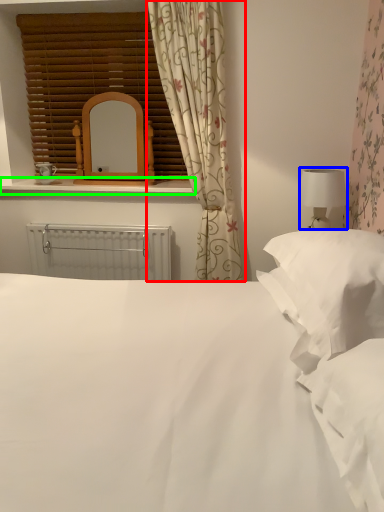
Question: Considering the real-world distances, which object is farthest from curtain (highlighted by a red box)? table lamp (highlighted by a blue box) or window sill (highlighted by a green box)?

Choices:
 (A) table lamp
 (B) window sill

Answer: (A)